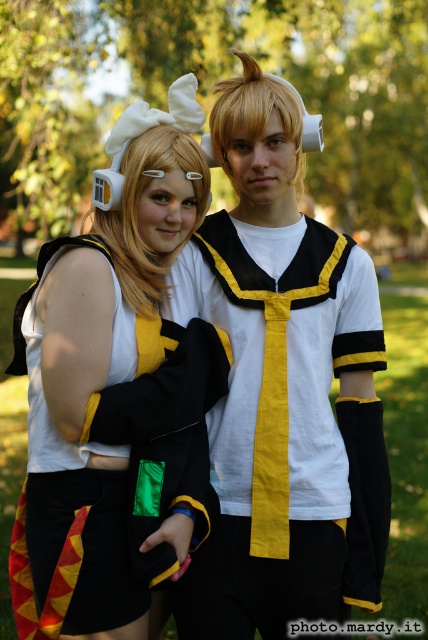
In the image, there are two objects at the center of the scene. They are the matte black sailor uniform at center and the matte black coat at center. Based on their positions, which one is located to the right side?

The matte black sailor uniform at center is to the right of the matte black coat at center.

Looking at this image, you are a photographer adjusting your camera settings to capture the scene. You notice the matte black sailor uniform at center and the matte black coat at center. Which object should you focus on first if you want to ensure both are in sharp focus, considering their positions?

The matte black sailor uniform at center is below the matte black coat at center, so focusing on the matte black coat at center first would help ensure both are in sharp focus since it is closer to the camera.

You are a photographer trying to capture a clear photo of the matte black sailor uniform at center and the matte black coat at center. Since both are matte black, you want to ensure they are distinguishable in the photo. What spatial detail can you use to differentiate them in the image?

The matte black coat at center is behind the matte black sailor uniform at center, so in the photo, the coat will appear slightly blurred compared to the sailor uniform due to depth of field, making them distinguishable.